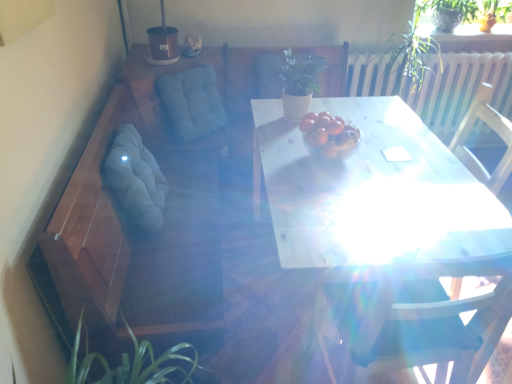
Question: Considering the relative positions of green matte plant at center, the 2th plant viewed from the right, and soft gray fabric swivel chair at left, the second swivel chair from the back, in the image provided, is green matte plant at center, the 2th plant viewed from the right, to the left or to the right of soft gray fabric swivel chair at left, the second swivel chair from the back,?

Choices:
 (A) right
 (B) left

Answer: (A)

Question: In terms of height, does green matte plant at center, placed as the first plant when sorted from left to right, look taller or shorter compared to soft gray fabric swivel chair at left, the second swivel chair from the back?

Choices:
 (A) tall
 (B) short

Answer: (B)

Question: Which object is positioned closest to the green fabric armchair at upper center?

Choices:
 (A) blue fabric cushion at upper left, which appears as the 1th swivel chair when viewed from the back
 (B) soft gray fabric swivel chair at left, marked as the first swivel chair in a front-to-back arrangement
 (C) green leafy plant at upper right, marked as the first plant in a right-to-left arrangement
 (D) white glossy table at center
 (E) green matte plant at center, the 2th plant viewed from the right

Answer: (A)

Question: Which is nearer to the blue fabric cushion at upper left, which appears as the second swivel chair when viewed from the front?

Choices:
 (A) green matte plant at center, the second plant viewed from the top
 (B) green leafy plant at upper right, the 2th plant positioned from the bottom
 (C) green fabric armchair at upper center
 (D) soft gray fabric swivel chair at left, the second swivel chair from the back
 (E) white glossy table at center

Answer: (C)